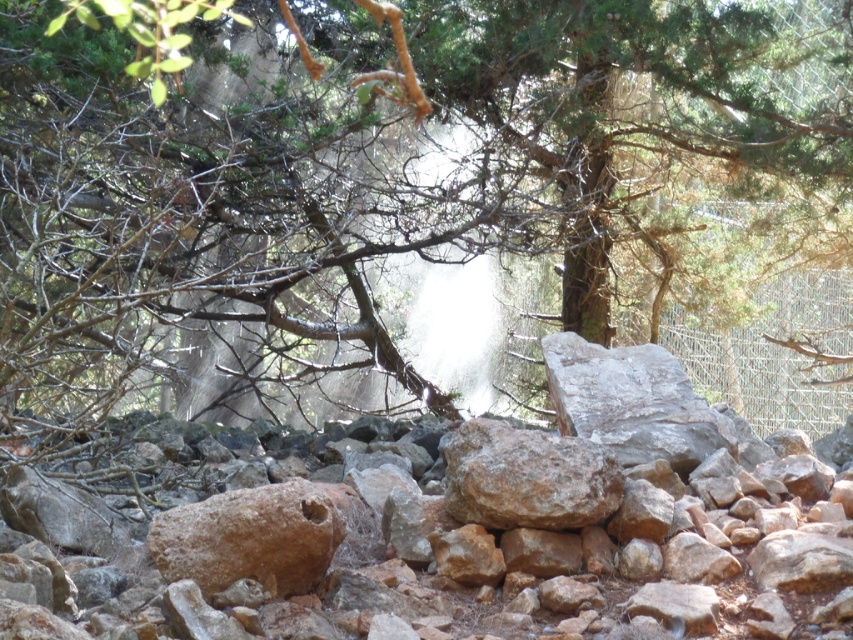
You are standing at the point labeled point (511, 634) in the image. You want to walk to the nearest tree in the midground. How far will you have to walk?

The distance between point (511, 634) and the nearest tree in the midground is 5.74 meters, so you will have to walk 5.74 meters.

You are a hiker trying to place a small flag on the tallest rock in the center of the rocky foreground. Which rock should you choose between the rusty stone at center and the brown rough rock at center?

The rusty stone at center is much taller than the brown rough rock at center, so you should choose the rusty stone at center to place the flag.

You are a hiker trying to place a 10 cm wide hiking boot between the rusty stone at center and the brown rough rock at center. Can you fit your boot between them?

The rusty stone at center might be wider than brown rough rock at center, so there is uncertainty about the space between them. You may need to check the actual distance before placing your boot.